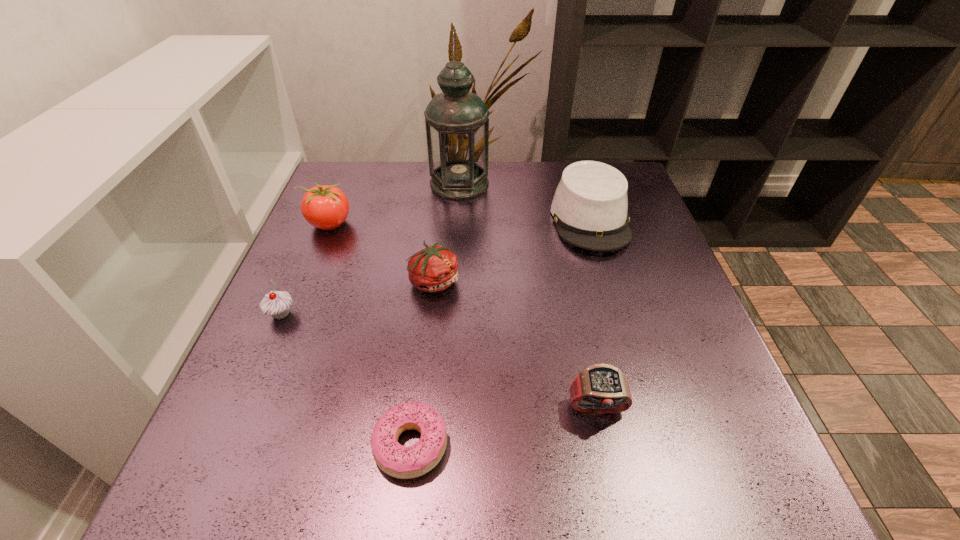
Identify the location of oil lamp. The height and width of the screenshot is (540, 960). (457, 125).

The image size is (960, 540). Find the location of `the farther tomato`. the farther tomato is located at coordinates (326, 207).

The width and height of the screenshot is (960, 540). Identify the location of the taller tomato. (326, 207).

Image resolution: width=960 pixels, height=540 pixels. Find the location of `hat`. hat is located at coordinates [590, 205].

Locate an element on the screen. Image resolution: width=960 pixels, height=540 pixels. the third nearest object is located at coordinates (277, 304).

Identify the location of the right tomato. (434, 268).

You are a GUI agent. You are given a task and a screenshot of the screen. Output one action in this format:
    pyautogui.click(x=<x>, y=<y>)
    Task: Click on the shorter tomato
    The height and width of the screenshot is (540, 960).
    Given the screenshot: What is the action you would take?
    pyautogui.click(x=434, y=268)

The width and height of the screenshot is (960, 540). Identify the location of watch. (601, 388).

Image resolution: width=960 pixels, height=540 pixels. Identify the location of the shortest object. (396, 460).

The image size is (960, 540). Find the location of `free space located 0.180m on the left of the oil lamp`. free space located 0.180m on the left of the oil lamp is located at coordinates (365, 184).